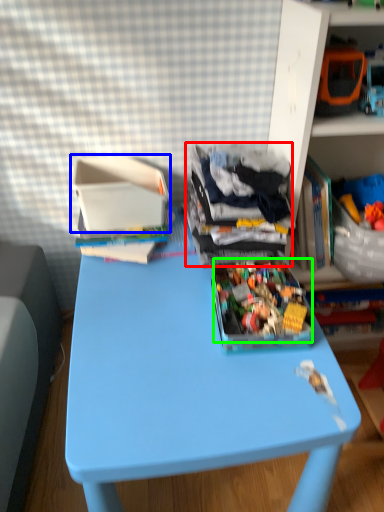
Question: Estimate the real-world distances between objects in this image. Which object is farther from clothing (highlighted by a red box), cardboard box (highlighted by a blue box) or toy (highlighted by a green box)?

Choices:
 (A) cardboard box
 (B) toy

Answer: (A)